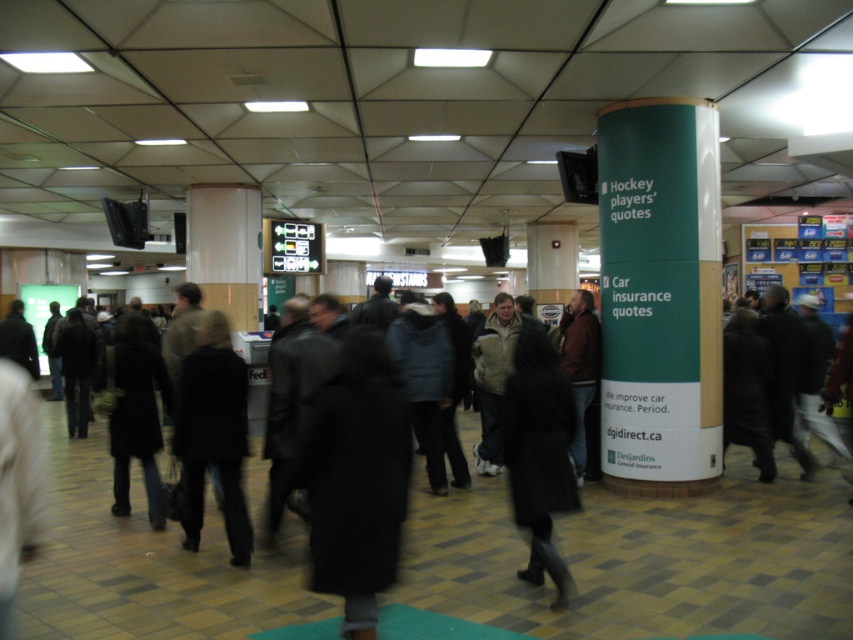
Is point (622, 444) less distant than point (370, 497)?

No, (622, 444) is further to viewer.

Is point (604, 323) positioned after point (374, 500)?

That is True.

The image size is (853, 640). I want to click on green matte sign at right, so click(659, 296).

The height and width of the screenshot is (640, 853). I want to click on green matte sign at right, so click(x=659, y=296).

Which is more to the left, black leather coat at lower center or dark brown leather coat at center?

dark brown leather coat at center is more to the left.

Who is higher up, black leather coat at lower center or dark brown leather coat at center?

dark brown leather coat at center is higher up.

Describe the element at coordinates (538, 454) in the screenshot. I see `black leather coat at lower center` at that location.

Locate an element on the screen. This screenshot has width=853, height=640. black leather coat at lower center is located at coordinates (538, 454).

Does dark brown leather coat at center appear on the right side of dark wool coat at left?

Answer: Correct, you'll find dark brown leather coat at center to the right of dark wool coat at left.

Is point (196, 417) less distant than point (148, 454)?

Yes, point (196, 417) is in front of point (148, 454).

You are a GUI agent. You are given a task and a screenshot of the screen. Output one action in this format:
    pyautogui.click(x=<x>, y=<y>)
    Task: Click on the dark brown leather coat at center
    The height and width of the screenshot is (640, 853).
    Given the screenshot: What is the action you would take?
    pyautogui.click(x=212, y=433)